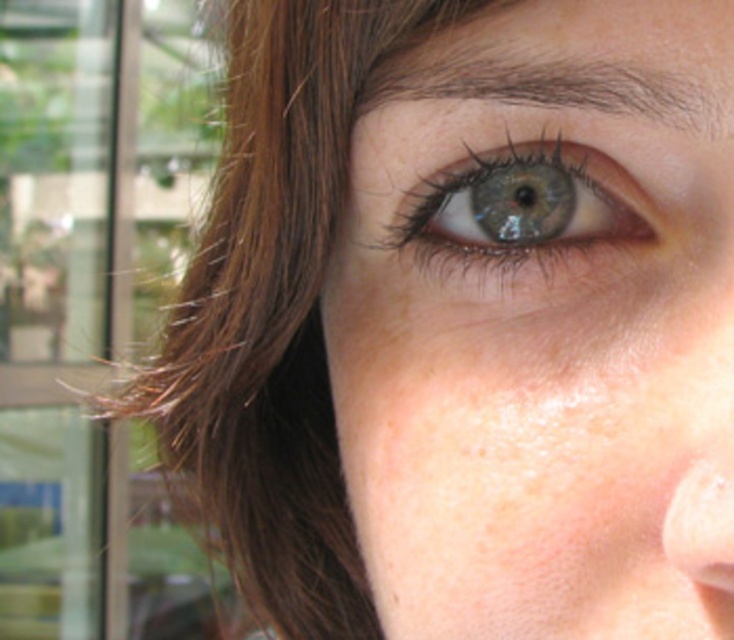
Based on the scene description, what is located at the coordinates point (x=542, y=324)?

The point (x=542, y=324) is where the smooth skin eye at center is located.

Based on the scene description, which object is larger between the smooth skin eye at center and the blue glossy eye at center?

The smooth skin eye at center is bigger than the blue glossy eye at center according to the description.

Looking at the person in the image, which object has a greater width between the smooth skin eye at center and the blue glossy eye at center?

The smooth skin eye at center has a greater width than the blue glossy eye at center.